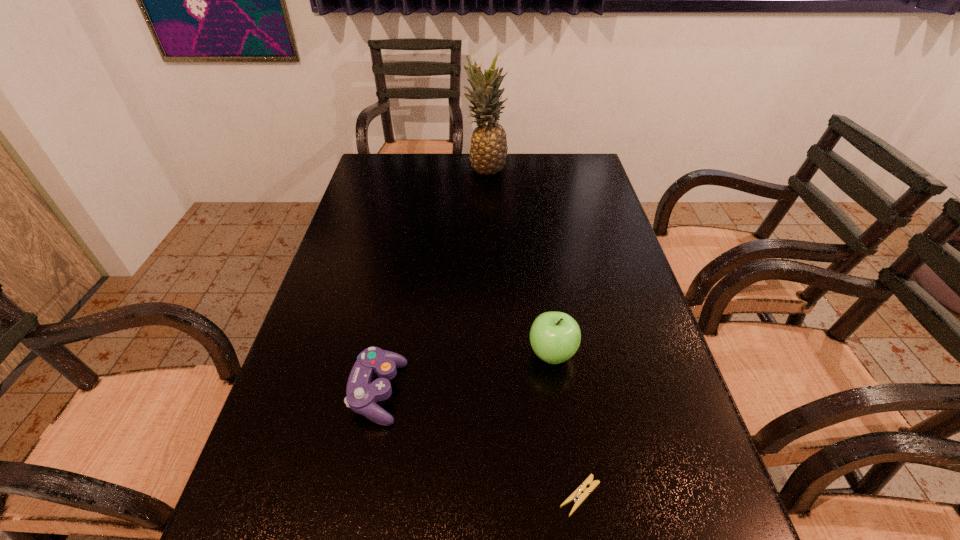
Where is `free space located on the back of the clothespin`? free space located on the back of the clothespin is located at coordinates (554, 332).

I want to click on object that is at the far edge, so click(x=488, y=151).

I want to click on object that is at the left edge, so click(363, 392).

You are a GUI agent. You are given a task and a screenshot of the screen. Output one action in this format:
    pyautogui.click(x=<x>, y=<y>)
    Task: Click on the vacant space at the far edge of the desktop
    Image resolution: width=960 pixels, height=540 pixels.
    Given the screenshot: What is the action you would take?
    pyautogui.click(x=417, y=182)

This screenshot has height=540, width=960. I want to click on vacant space at the left edge of the desktop, so click(323, 357).

Where is `vacant area at the right edge of the desktop`? The height and width of the screenshot is (540, 960). vacant area at the right edge of the desktop is located at coordinates (589, 194).

The width and height of the screenshot is (960, 540). I want to click on free space between the pineapple and the control, so click(432, 280).

Locate an element on the screen. This screenshot has width=960, height=540. free space between the second object from left to right and the second tallest object is located at coordinates (519, 261).

You are a GUI agent. You are given a task and a screenshot of the screen. Output one action in this format:
    pyautogui.click(x=<x>, y=<y>)
    Task: Click on the vacant area between the apple and the clothespin
    The width and height of the screenshot is (960, 540).
    Given the screenshot: What is the action you would take?
    tap(566, 425)

Where is `vacant region between the tallest object and the third shortest object`? This screenshot has width=960, height=540. vacant region between the tallest object and the third shortest object is located at coordinates (519, 261).